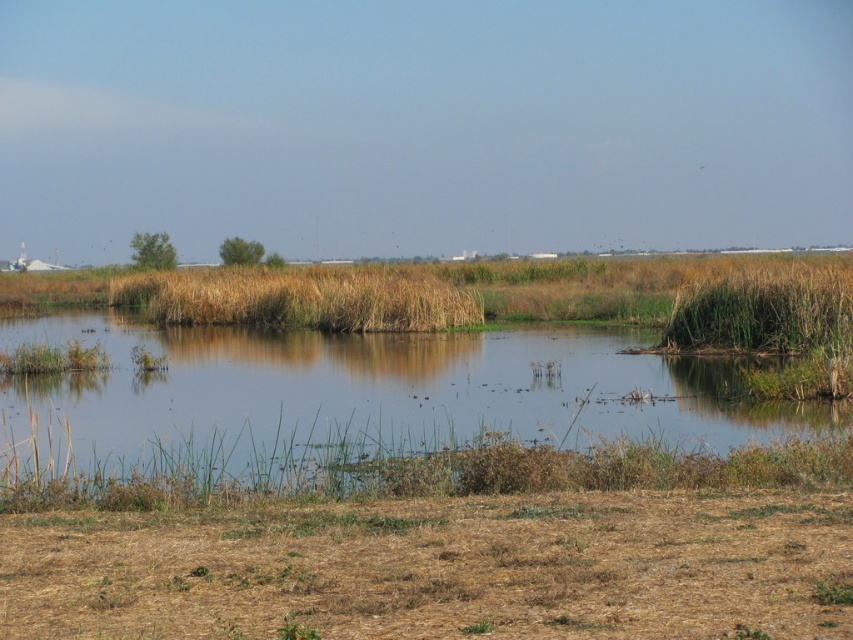
Question: Is the position of green grassy water at center more distant than that of brown grassy reed at center?

Choices:
 (A) yes
 (B) no

Answer: (B)

Question: Which point is farther to the camera?

Choices:
 (A) green grassy water at center
 (B) brown grassy reed at center

Answer: (B)

Question: Which object is farther from the camera taking this photo?

Choices:
 (A) green grassy water at center
 (B) brown grassy reed at center

Answer: (B)

Question: Is green grassy water at center above brown grassy reed at center?

Choices:
 (A) yes
 (B) no

Answer: (B)

Question: Is green grassy water at center below brown grassy reed at center?

Choices:
 (A) no
 (B) yes

Answer: (B)